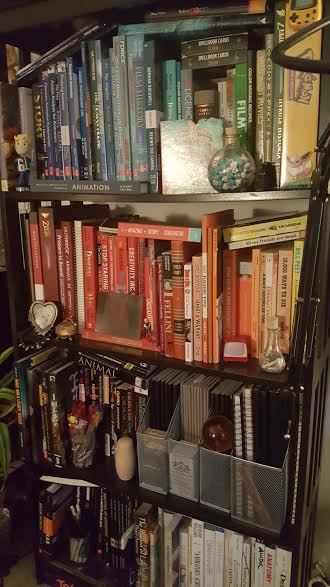
Image resolution: width=330 pixels, height=587 pixels. I want to click on plant, so click(x=8, y=390).